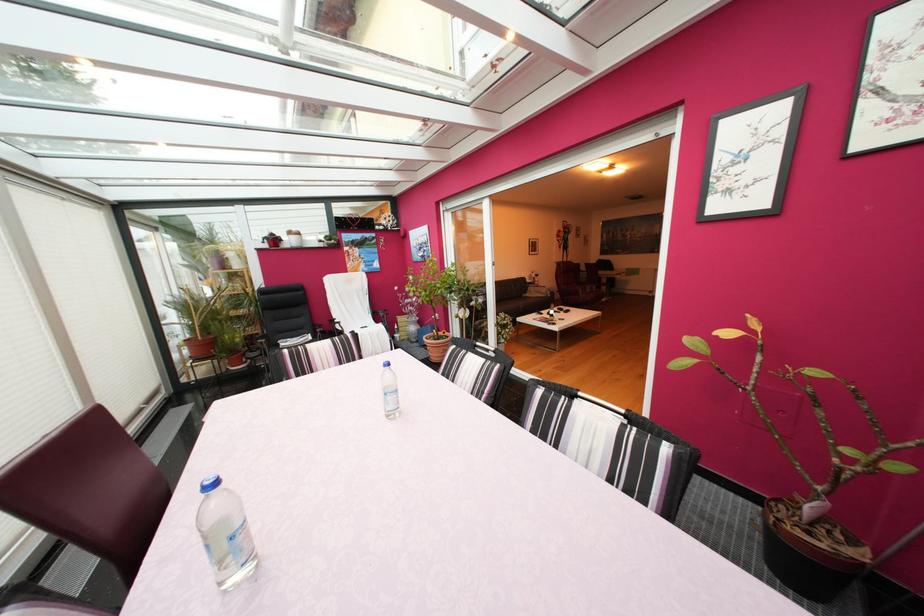
The width and height of the screenshot is (924, 616). What do you see at coordinates (515, 299) in the screenshot? I see `a sofa sitting surface` at bounding box center [515, 299].